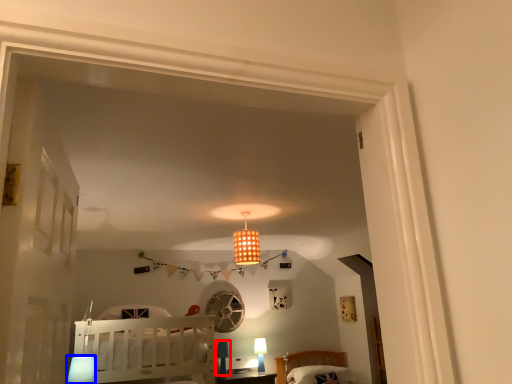
Question: Among these objects, which one is nearest to the camera, lamp (highlighted by a red box) or lamp (highlighted by a blue box)?

Choices:
 (A) lamp
 (B) lamp

Answer: (B)